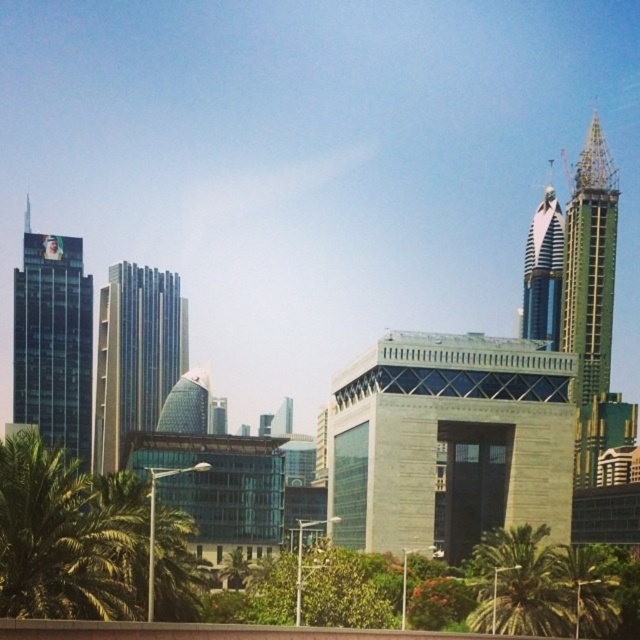
Question: Among these points, which one is farthest from the camera?

Choices:
 (A) click(129, 330)
 (B) click(67, 310)
 (C) click(580, 364)
 (D) click(566, 600)

Answer: (A)

Question: Does glassy steel skyscraper at center lie in front of green leafy palm tree at lower center?

Choices:
 (A) no
 (B) yes

Answer: (A)

Question: Which object is the farthest from the green leafy palm tree at lower left?

Choices:
 (A) green leafy palm tree at lower right
 (B) green glass tower at upper right
 (C) green leafy palm tree at lower center

Answer: (B)

Question: Considering the relative positions of green leafy palm tree at lower left and green glass tower at upper right in the image provided, where is green leafy palm tree at lower left located with respect to green glass tower at upper right?

Choices:
 (A) below
 (B) above

Answer: (A)

Question: Which object appears farthest from the camera in this image?

Choices:
 (A) green leafy palm tree at lower right
 (B) green leafy palm tree at lower center

Answer: (B)

Question: Does green leafy palm tree at lower center have a greater width compared to glass skyscraper at upper right?

Choices:
 (A) no
 (B) yes

Answer: (A)